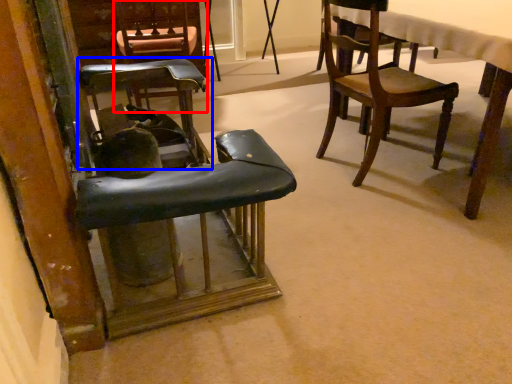
Question: Which object appears farthest to the camera in this image, chair (highlighted by a red box) or chair (highlighted by a blue box)?

Choices:
 (A) chair
 (B) chair

Answer: (A)